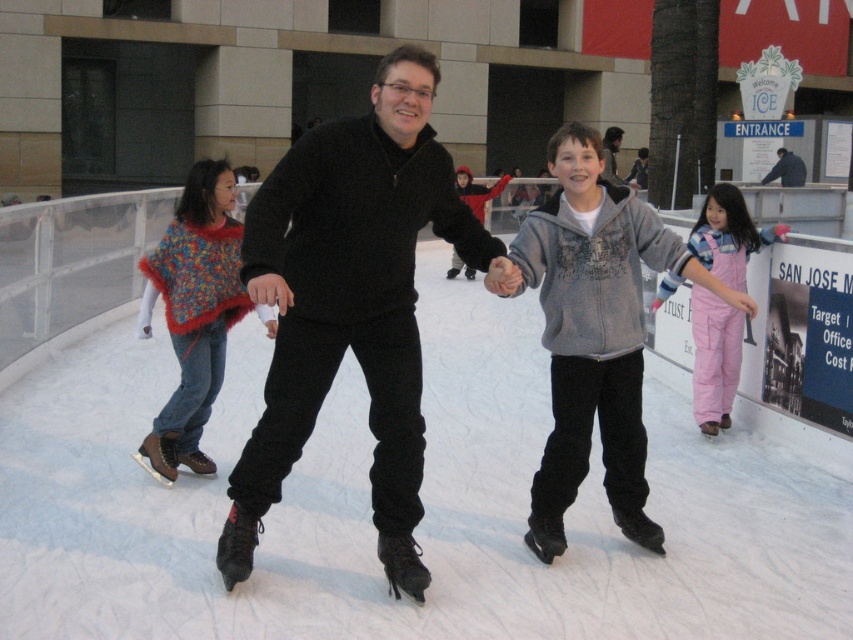
You are an ice skater standing on the rink. You see the black matte sweater at center and another person wearing a gray hoodie at lower right. Which direction should you skate to get closer to the person in the gray hoodie at lower right?

The black matte sweater at center is 10.60 feet away from the person in the gray hoodie at lower right. To get closer to the gray hoodie at lower right, you should skate towards the lower right direction.

You are standing at the entrance of the ice rink and see the black matte sweater at center. If you want to reach it within 5 meters, can you do it?

The black matte sweater at center is 3.23 meters away from camera, so yes, you can reach it within 5 meters.